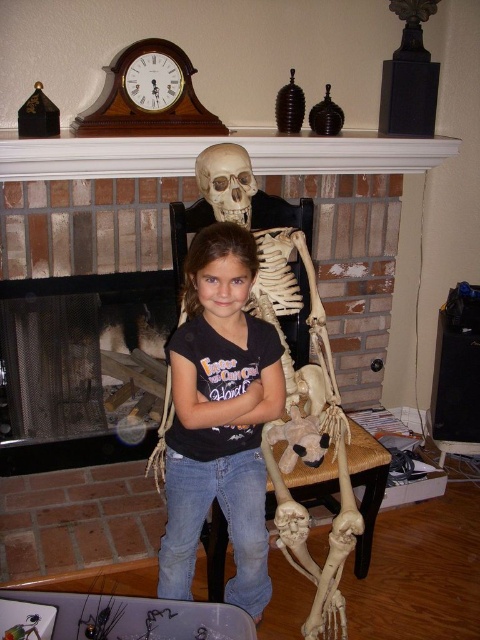
Is brick fireplace at center bigger than matte black shirt at center?

Yes.

Can you confirm if brick fireplace at center is wider than matte black shirt at center?

Correct, the width of brick fireplace at center exceeds that of matte black shirt at center.

The image size is (480, 640). What are the coordinates of `brick fireplace at center` in the screenshot? It's located at (192, 172).

This screenshot has height=640, width=480. I want to click on brick fireplace at center, so click(192, 172).

Based on the photo, does brick fireplace at center have a smaller size compared to matte plastic skull at upper center?

Incorrect, brick fireplace at center is not smaller in size than matte plastic skull at upper center.

Based on the photo, does brick fireplace at center have a greater width compared to matte plastic skull at upper center?

Yes, brick fireplace at center is wider than matte plastic skull at upper center.

You are a GUI agent. You are given a task and a screenshot of the screen. Output one action in this format:
    pyautogui.click(x=<x>, y=<y>)
    Task: Click on the brick fireplace at center
    
    Given the screenshot: What is the action you would take?
    pyautogui.click(x=192, y=172)

Find the location of a particular element. Image resolution: width=480 pixels, height=640 pixels. brick fireplace at center is located at coordinates click(192, 172).

Which is above, matte black shirt at center or matte plastic skull at upper center?

matte plastic skull at upper center is above.

Identify the location of matte black shirt at center. The width and height of the screenshot is (480, 640). (219, 417).

Does point (239, 458) come behind point (231, 188)?

No, it is in front of (231, 188).

Locate an element on the screen. matte black shirt at center is located at coordinates (219, 417).